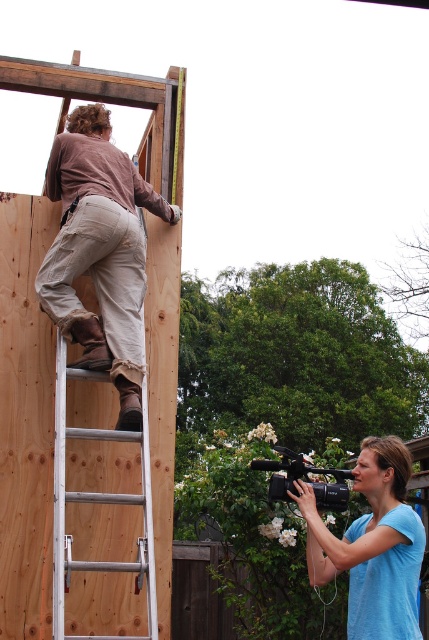
Question: Estimate the real-world distances between objects in this image. Which object is closer to the natural wood plywood at upper left?

Choices:
 (A) blue matte camera at lower right
 (B) silver metallic ladder at left

Answer: (B)

Question: Among these objects, which one is nearest to the camera?

Choices:
 (A) blue matte camera at lower right
 (B) khaki pants at upper left
 (C) natural wood plywood at upper left

Answer: (A)

Question: Does khaki pants at upper left lie behind silver metallic ladder at left?

Choices:
 (A) yes
 (B) no

Answer: (A)

Question: Is khaki pants at upper left thinner than blue matte camera at lower right?

Choices:
 (A) yes
 (B) no

Answer: (B)

Question: Which of these objects is positioned farthest from the blue matte camera at lower right?

Choices:
 (A) khaki pants at upper left
 (B) silver metallic ladder at left

Answer: (A)

Question: Is natural wood plywood at upper left further to the viewer compared to blue matte camera at lower right?

Choices:
 (A) no
 (B) yes

Answer: (B)